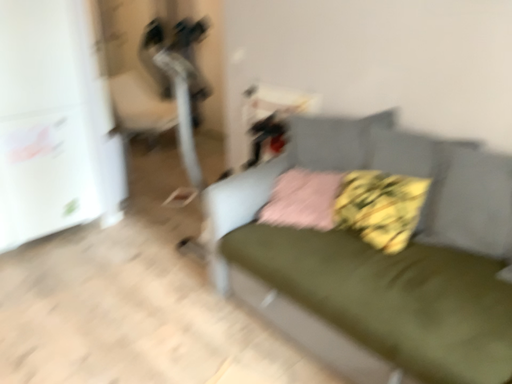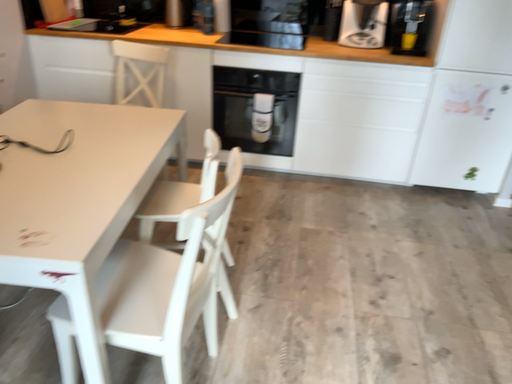
Question: How did the camera likely rotate when shooting the video?

Choices:
 (A) rotated downward
 (B) rotated upward

Answer: (B)